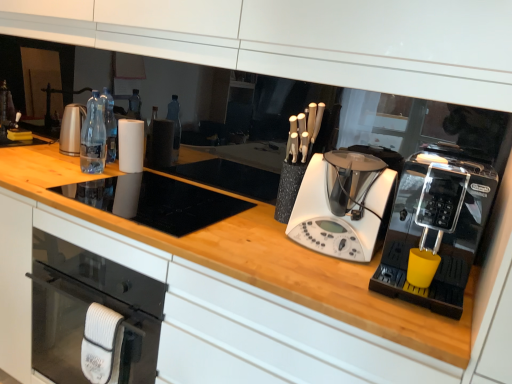
Question: Is black plastic coffee machine at right, arranged as the second home appliance when viewed from the left, not near clear plastic bottles at center?

Choices:
 (A) no
 (B) yes

Answer: (B)

Question: From a real-world perspective, is black plastic coffee machine at right, arranged as the second home appliance when viewed from the left, on top of clear plastic bottles at center?

Choices:
 (A) yes
 (B) no

Answer: (A)

Question: Can you confirm if black plastic coffee machine at right, arranged as the second home appliance when viewed from the left, is smaller than clear plastic bottles at center?

Choices:
 (A) no
 (B) yes

Answer: (A)

Question: Does black plastic coffee machine at right, which is the 1th home appliance from right to left, appear on the right side of clear plastic bottles at center?

Choices:
 (A) yes
 (B) no

Answer: (A)

Question: Is black plastic coffee machine at right, arranged as the second home appliance when viewed from the left, to the left of clear plastic bottles at center from the viewer's perspective?

Choices:
 (A) no
 (B) yes

Answer: (A)

Question: Is the depth of black plastic coffee machine at right, which is the 1th home appliance from right to left, less than that of clear plastic bottles at center?

Choices:
 (A) no
 (B) yes

Answer: (B)

Question: Is black plastic coffee machine at right, arranged as the second home appliance when viewed from the left, completely or partially inside clear plastic bottles at center?

Choices:
 (A) no
 (B) yes

Answer: (A)

Question: From a real-world perspective, is clear plastic bottles at center physically below black plastic coffee machine at right, which is the 1th home appliance from right to left?

Choices:
 (A) no
 (B) yes

Answer: (B)

Question: Is clear plastic bottles at center in contact with black plastic coffee machine at right, arranged as the second home appliance when viewed from the left?

Choices:
 (A) no
 (B) yes

Answer: (A)

Question: Considering the relative positions of clear plastic bottles at center and black plastic coffee machine at right, arranged as the second home appliance when viewed from the left, in the image provided, is clear plastic bottles at center to the left of black plastic coffee machine at right, arranged as the second home appliance when viewed from the left, from the viewer's perspective?

Choices:
 (A) yes
 (B) no

Answer: (A)

Question: From the image's perspective, is clear plastic bottles at center on black plastic coffee machine at right, which is the 1th home appliance from right to left?

Choices:
 (A) no
 (B) yes

Answer: (B)

Question: Can you confirm if clear plastic bottles at center is positioned to the right of black plastic coffee machine at right, arranged as the second home appliance when viewed from the left?

Choices:
 (A) yes
 (B) no

Answer: (B)

Question: Is white plastic blender at center, acting as the second home appliance starting from the right, positioned far away from clear plastic bottles at center?

Choices:
 (A) yes
 (B) no

Answer: (A)